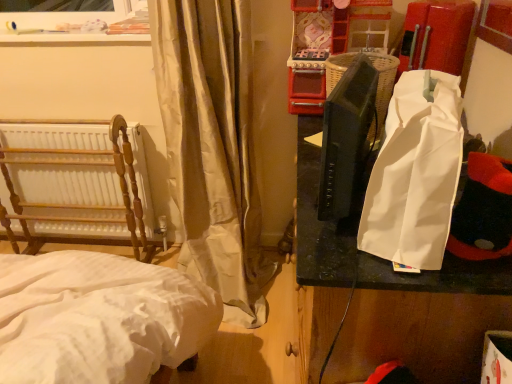
Question: From the image's perspective, is silky beige curtain at left over white paper bag at right?

Choices:
 (A) yes
 (B) no

Answer: (A)

Question: Considering the relative positions of silky beige curtain at left and white paper bag at right in the image provided, is silky beige curtain at left to the left of white paper bag at right from the viewer's perspective?

Choices:
 (A) yes
 (B) no

Answer: (A)

Question: From the image's perspective, is silky beige curtain at left below white paper bag at right?

Choices:
 (A) no
 (B) yes

Answer: (A)

Question: Is silky beige curtain at left not inside white paper bag at right?

Choices:
 (A) no
 (B) yes

Answer: (B)

Question: Does silky beige curtain at left turn towards white paper bag at right?

Choices:
 (A) no
 (B) yes

Answer: (A)

Question: Is white paper bag at right located within silky beige curtain at left?

Choices:
 (A) no
 (B) yes

Answer: (A)

Question: Considering the relative positions of wooden radiator at left and silky beige curtain at left in the image provided, is wooden radiator at left to the left of silky beige curtain at left from the viewer's perspective?

Choices:
 (A) yes
 (B) no

Answer: (A)

Question: From a real-world perspective, is wooden radiator at left on top of silky beige curtain at left?

Choices:
 (A) no
 (B) yes

Answer: (A)

Question: Does wooden radiator at left have a lesser height compared to silky beige curtain at left?

Choices:
 (A) yes
 (B) no

Answer: (A)

Question: From the image's perspective, is wooden radiator at left located beneath silky beige curtain at left?

Choices:
 (A) yes
 (B) no

Answer: (A)

Question: Can you confirm if wooden radiator at left is wider than silky beige curtain at left?

Choices:
 (A) yes
 (B) no

Answer: (B)

Question: Is wooden radiator at left smaller than silky beige curtain at left?

Choices:
 (A) no
 (B) yes

Answer: (B)

Question: Is the position of silky beige curtain at left more distant than that of white paper bag at right?

Choices:
 (A) no
 (B) yes

Answer: (B)